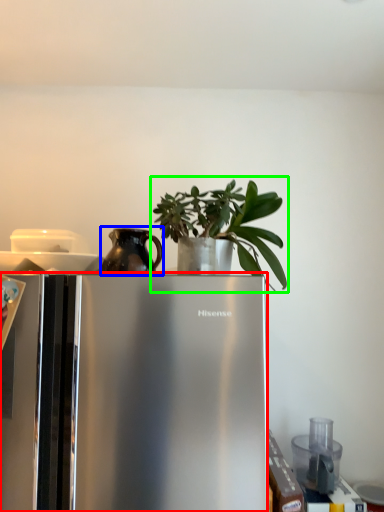
Question: Based on their relative distances, which object is farther from refrigerator (highlighted by a red box)? Choose from jug (highlighted by a blue box) and houseplant (highlighted by a green box).

Choices:
 (A) jug
 (B) houseplant

Answer: (B)